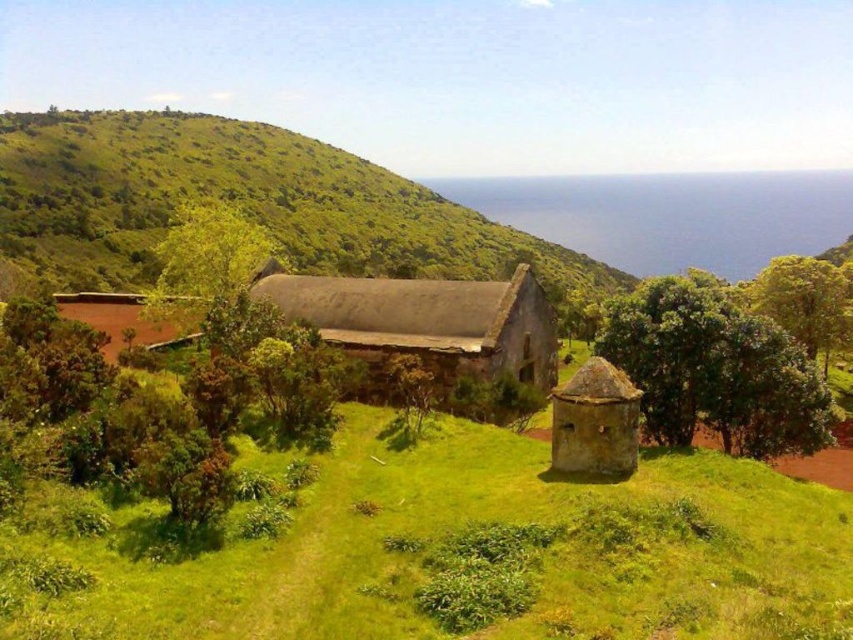
Does green leafy tree at center-right have a greater width compared to rusty metal hut at center?

In fact, green leafy tree at center-right might be narrower than rusty metal hut at center.

Is green leafy tree at center-right thinner than rusty metal hut at center?

Yes, green leafy tree at center-right is thinner than rusty metal hut at center.

What do you see at coordinates (715, 369) in the screenshot?
I see `green leafy tree at center-right` at bounding box center [715, 369].

This screenshot has height=640, width=853. Find the location of `green leafy tree at center-right`. green leafy tree at center-right is located at coordinates (715, 369).

Does rusty metal hut at center have a smaller size compared to green leafy tree at center?

Yes, rusty metal hut at center is smaller than green leafy tree at center.

Is rusty metal hut at center closer to the viewer compared to green leafy tree at center?

No, rusty metal hut at center is further to the viewer.

Between point (422, 349) and point (184, 289), which one is positioned behind?

Point (184, 289)

Image resolution: width=853 pixels, height=640 pixels. Find the location of `rusty metal hut at center`. rusty metal hut at center is located at coordinates (427, 324).

Can you confirm if green grassy at center is positioned to the right of green grassy hillside at center?

Indeed, green grassy at center is positioned on the right side of green grassy hillside at center.

Is point (405, 566) closer to viewer compared to point (41, 116)?

Yes.

Where is `green grassy at center`? green grassy at center is located at coordinates (461, 552).